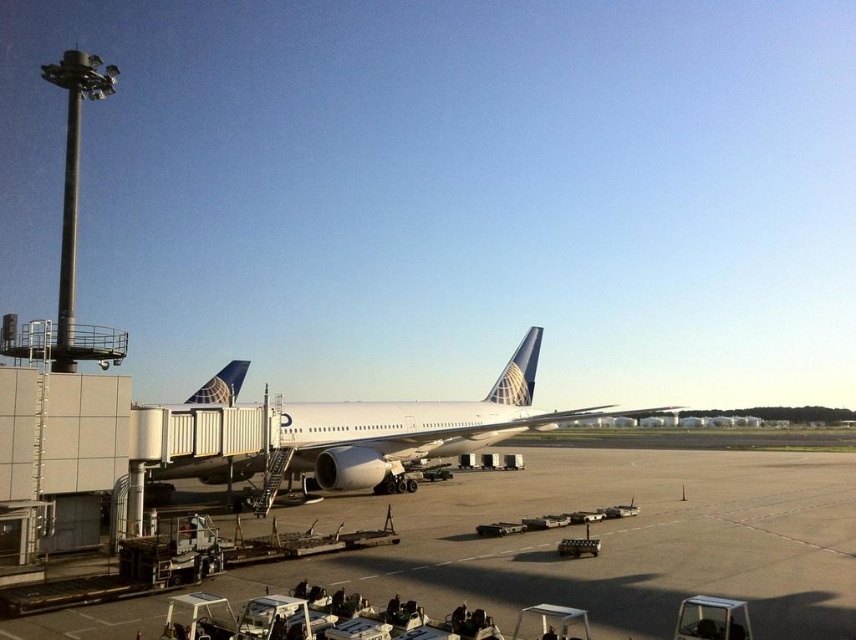
Question: Which point is closer to the camera?

Choices:
 (A) white matte airplane at center
 (B) smooth concrete tarmac at center

Answer: (B)

Question: Does smooth concrete tarmac at center come in front of white matte airplane at center?

Choices:
 (A) no
 (B) yes

Answer: (B)

Question: Which object is closer to the camera taking this photo?

Choices:
 (A) smooth concrete tarmac at center
 (B) white matte airplane at center

Answer: (A)

Question: Does smooth concrete tarmac at center appear on the left side of white matte airplane at center?

Choices:
 (A) no
 (B) yes

Answer: (A)

Question: Can you confirm if smooth concrete tarmac at center is wider than white matte airplane at center?

Choices:
 (A) no
 (B) yes

Answer: (A)